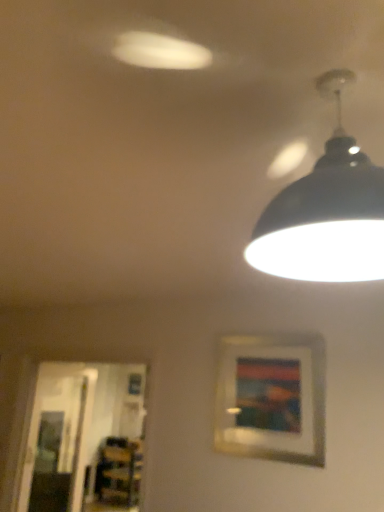
Question: From a real-world perspective, is wooden bookshelf at lower left positioned above or below transparent glass door at lower left, which is the second glass door in back-to-front order?

Choices:
 (A) above
 (B) below

Answer: (B)

Question: From the image's perspective, relative to transparent glass door at lower left, arranged as the 1th glass door when viewed from the right, is wooden bookshelf at lower left above or below?

Choices:
 (A) below
 (B) above

Answer: (A)

Question: Based on their relative distances, which object is farther from the wooden picture frame at center?

Choices:
 (A) transparent glass door at left, the second glass door in the front-to-back sequence
 (B) wooden bookshelf at lower left
 (C) black matte lampshade at upper right
 (D) transparent glass door at lower left, placed as the 1th glass door when sorted from front to back

Answer: (A)

Question: Estimate the real-world distances between objects in this image. Which object is closer to the wooden picture frame at center?

Choices:
 (A) transparent glass door at lower left, the 2th glass door in the left-to-right sequence
 (B) transparent glass door at left, the second glass door in the front-to-back sequence
 (C) wooden bookshelf at lower left
 (D) black matte lampshade at upper right

Answer: (D)